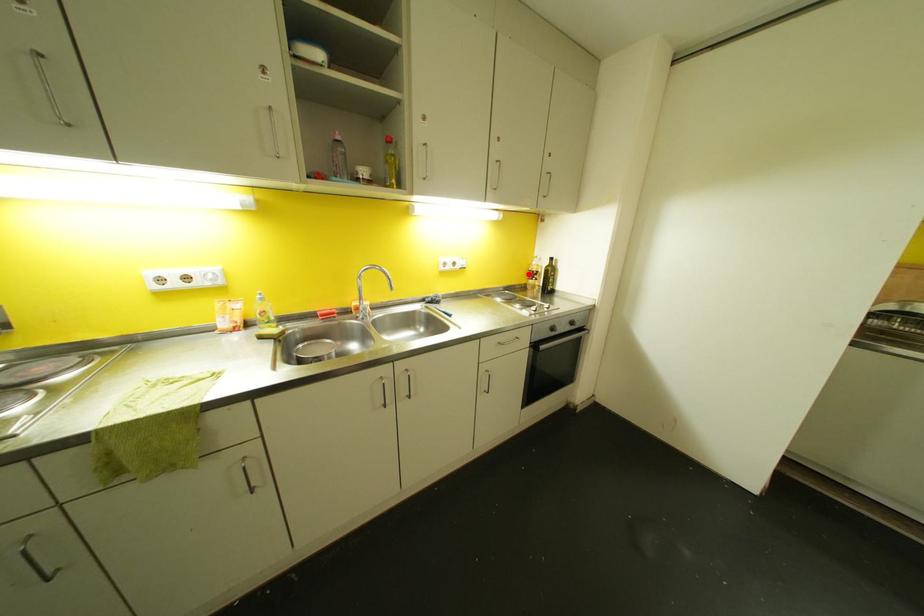
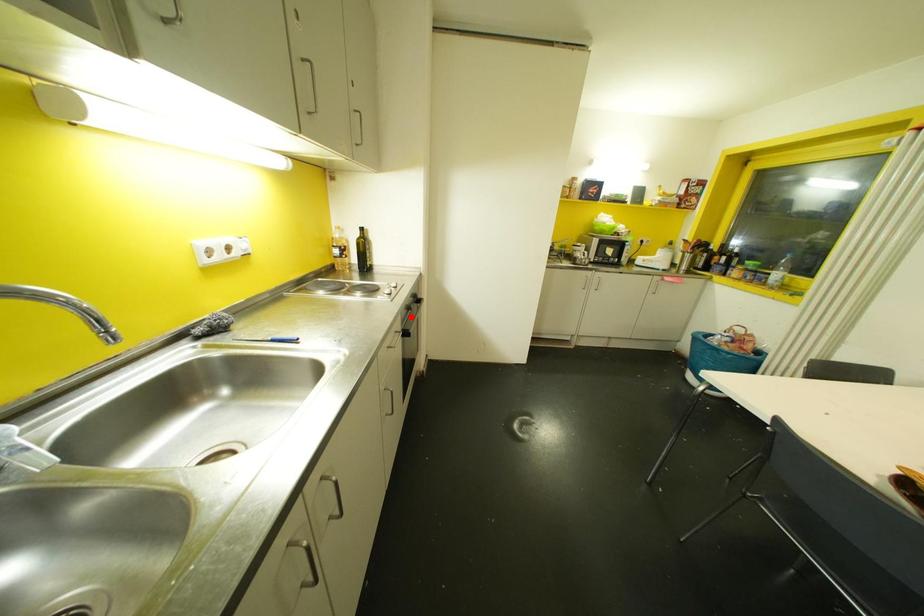
I am providing you with two images of the same scene from different viewpoints. A red point is marked on the first image and another point is marked on the second image. Is the marked point in image1 the same physical position as the marked point in image2?

No